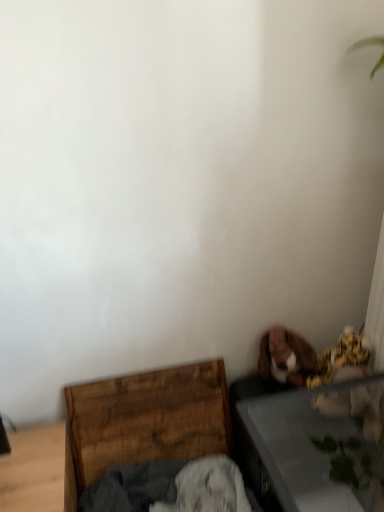
Question: From their relative heights in the image, would you say transparent glass table at lower right is taller or shorter than dark gray cotton cloth at lower center?

Choices:
 (A) tall
 (B) short

Answer: (A)

Question: Visually, is transparent glass table at lower right positioned to the left or to the right of dark gray cotton cloth at lower center?

Choices:
 (A) left
 (B) right

Answer: (B)

Question: Which is nearer to the wooden chest at lower left?

Choices:
 (A) transparent glass table at lower right
 (B) dark gray cotton cloth at lower center
 (C) brown plush dog at lower right

Answer: (B)

Question: Which of these objects is positioned closest to the brown plush dog at lower right?

Choices:
 (A) transparent glass table at lower right
 (B) dark gray cotton cloth at lower center
 (C) wooden chest at lower left

Answer: (A)